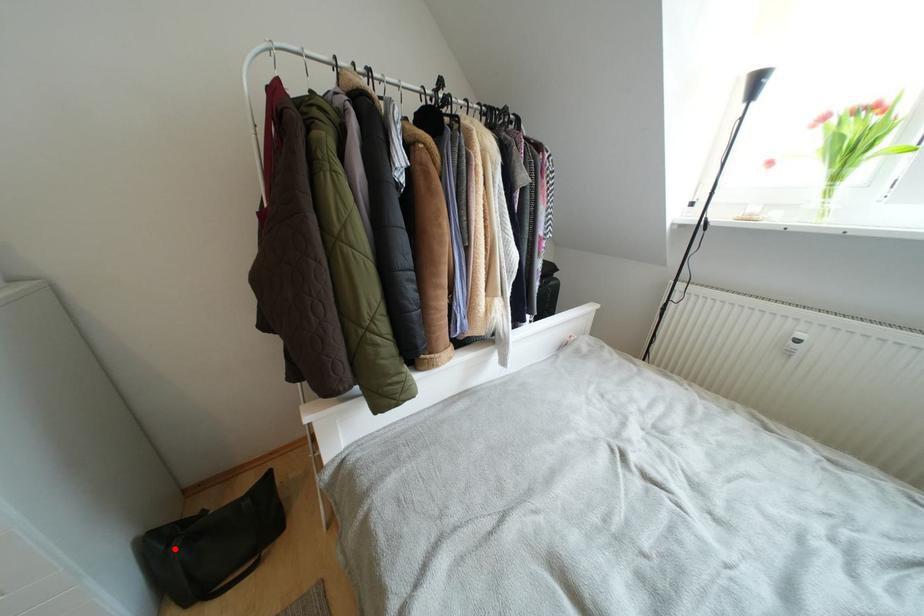
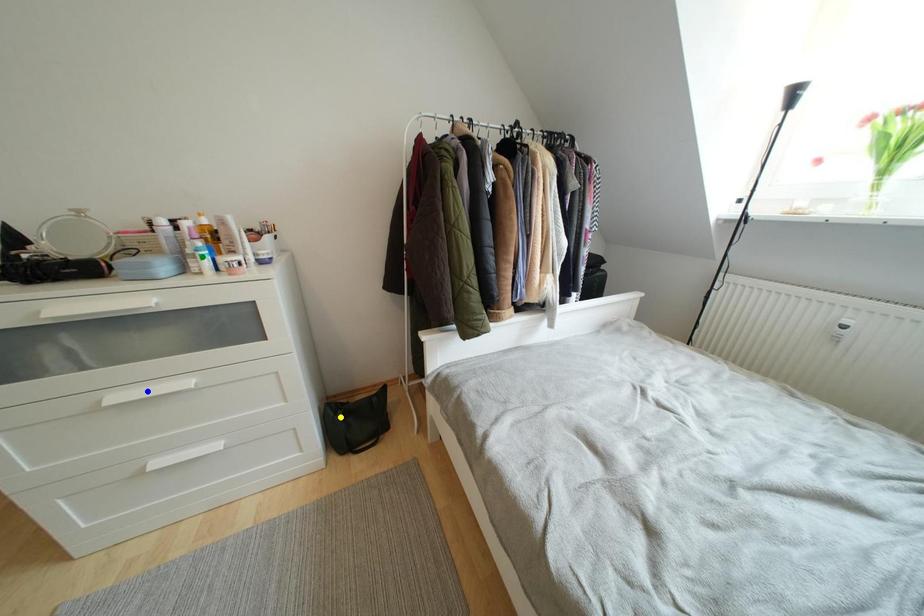
Question: I am providing you with two images of the same scene from different viewpoints. A red point is marked on the first image. You are given multiple points on the second image. Which mark in image 2 goes with the point in image 1?

Choices:
 (A) green point
 (B) blue point
 (C) yellow point

Answer: (C)